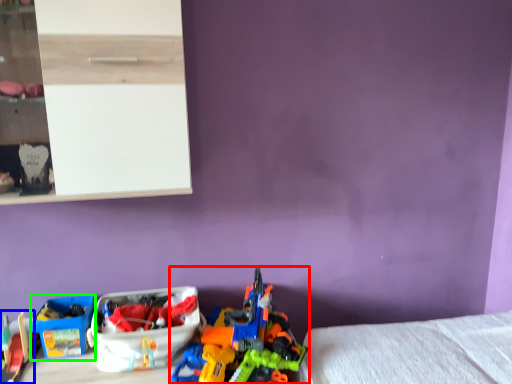
Question: Which object is the farthest from toy (highlighted by a red box)? Choose among these: toy (highlighted by a blue box) or storage box (highlighted by a green box).

Choices:
 (A) toy
 (B) storage box

Answer: (A)